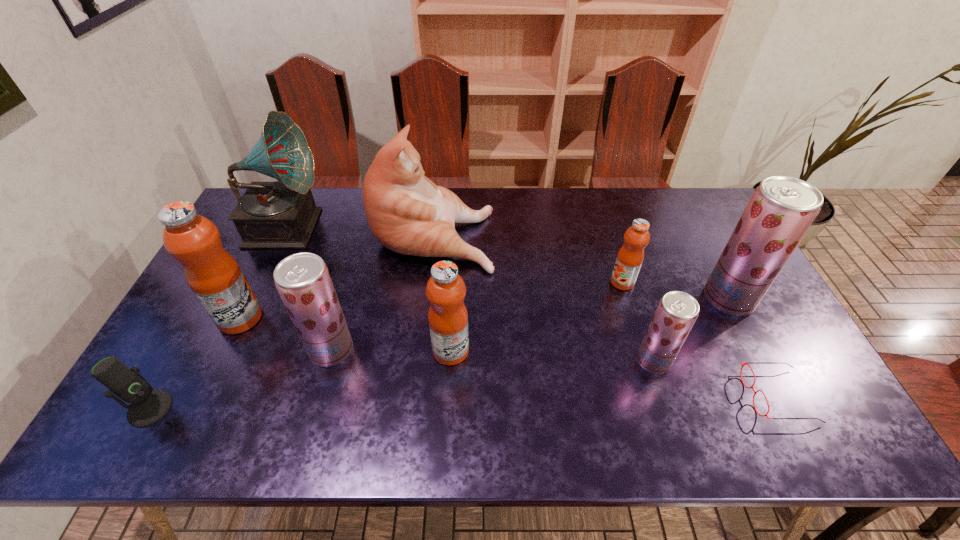
This screenshot has height=540, width=960. I want to click on record player present at the far edge, so click(282, 214).

This screenshot has width=960, height=540. In order to click on cat at the far edge in this screenshot , I will do `click(409, 214)`.

Where is `microphone positioned at the near edge`? This screenshot has width=960, height=540. microphone positioned at the near edge is located at coordinates (148, 406).

Locate an element on the screen. This screenshot has height=540, width=960. spectacles located at the near edge is located at coordinates (747, 363).

The height and width of the screenshot is (540, 960). Identify the location of record player present at the left edge. (282, 214).

Locate an element on the screen. The image size is (960, 540). fruit juice at the left edge is located at coordinates (214, 276).

You are a GUI agent. You are given a task and a screenshot of the screen. Output one action in this format:
    pyautogui.click(x=<x>, y=<y>)
    Task: Click on the microphone located in the left edge section of the desktop
    
    Given the screenshot: What is the action you would take?
    pyautogui.click(x=148, y=406)

This screenshot has width=960, height=540. In order to click on fruit juice located in the right edge section of the desktop in this screenshot , I will do `click(781, 210)`.

Find the location of a particular element. spectacles present at the right edge is located at coordinates (747, 363).

Where is `object located at the far left corner`? This screenshot has width=960, height=540. object located at the far left corner is located at coordinates (282, 214).